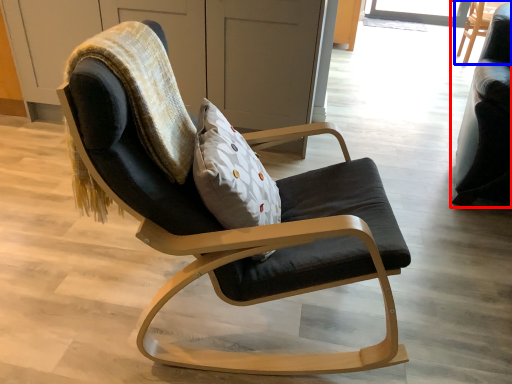
Question: Which of the following is the closest to the observer, chair (highlighted by a red box) or chair (highlighted by a blue box)?

Choices:
 (A) chair
 (B) chair

Answer: (A)